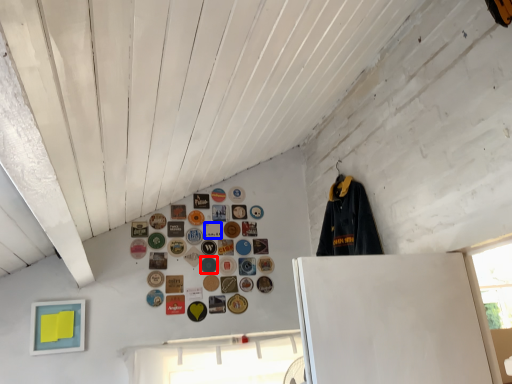
Question: Among these objects, which one is nearest to the camera, button (highlighted by a red box) or button (highlighted by a blue box)?

Choices:
 (A) button
 (B) button

Answer: (A)